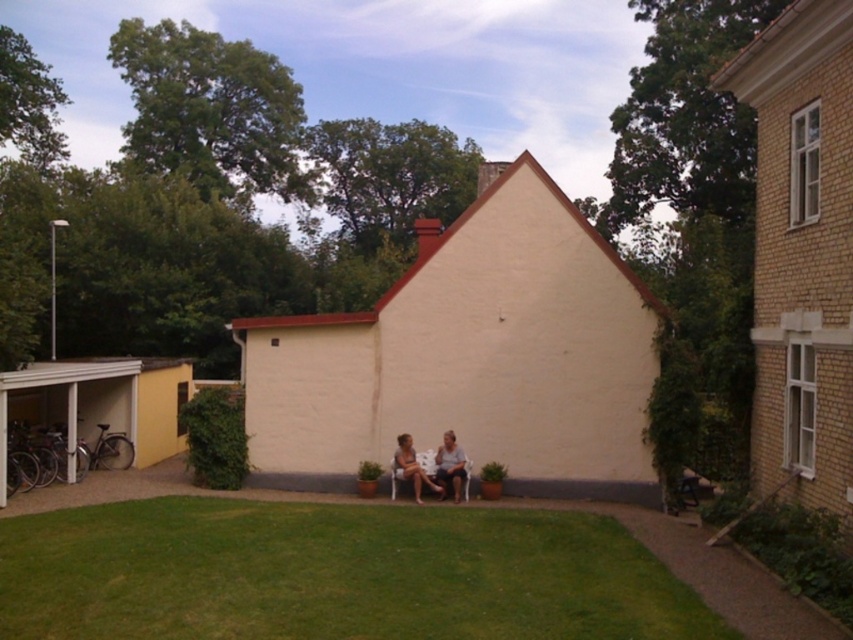
Which is more to the right, matte white chairs at center or smooth beige shirt at center?

Positioned to the right is smooth beige shirt at center.

Does matte white chairs at center have a lesser width compared to smooth beige shirt at center?

Incorrect, matte white chairs at center's width is not less than smooth beige shirt at center's.

Is point (442, 440) farther from viewer compared to point (451, 481)?

Yes, point (442, 440) is farther from viewer.

Where is `matte white chairs at center`? matte white chairs at center is located at coordinates (432, 467).